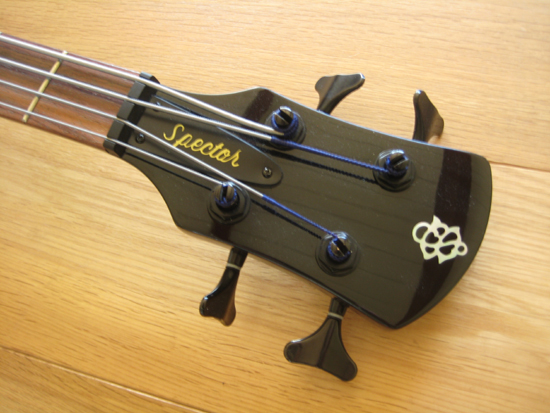
The width and height of the screenshot is (550, 413). In order to click on light brown wooden surface in this screenshot , I will do `click(454, 375)`.